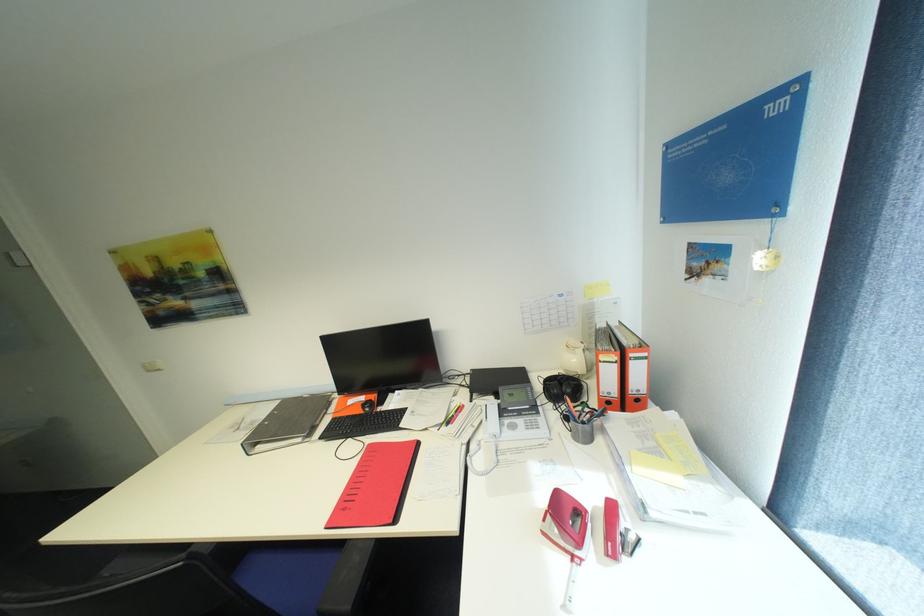
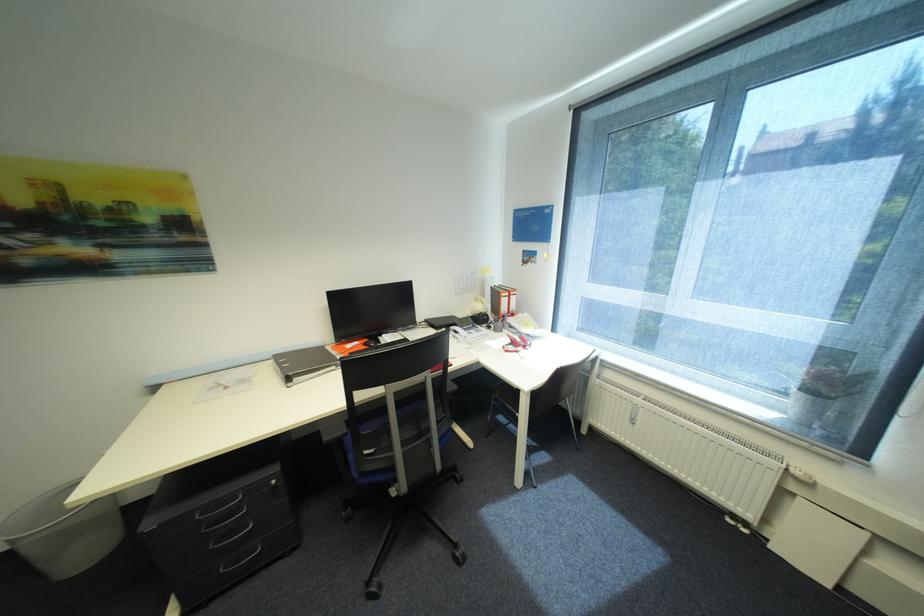
Where in the second image is the point corresponding to (714,281) from the first image?

(537, 265)